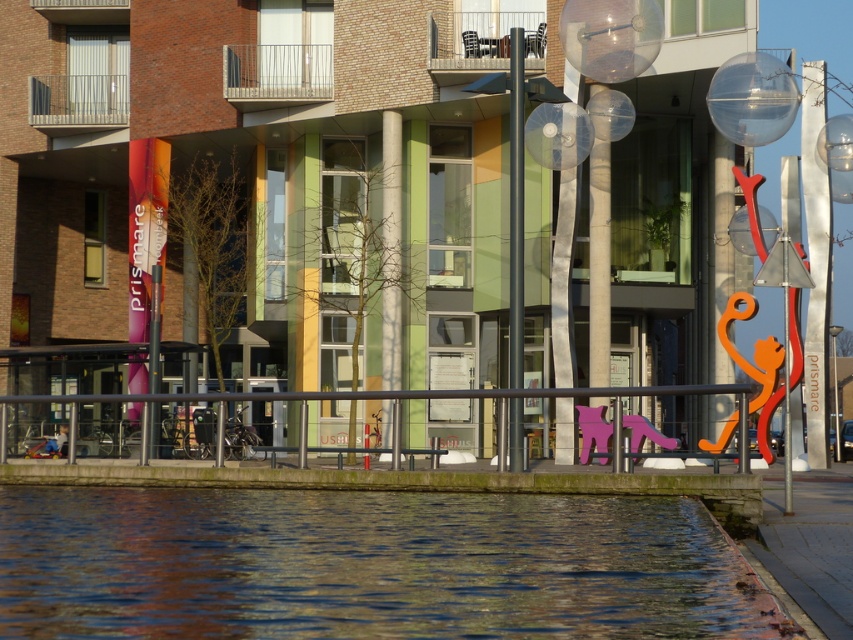
Which is behind, point (619, 602) or point (218, 456)?

The point (218, 456) is more distant.

Does point (361, 609) come closer to viewer compared to point (53, 403)?

Yes, it is in front of point (53, 403).

Is point (218, 586) less distant than point (79, 396)?

Yes, point (218, 586) is closer to viewer.

I want to click on clear water at lower left, so click(369, 564).

Find the location of a particular element. The width and height of the screenshot is (853, 640). clear water at lower left is located at coordinates (369, 564).

Which is above, clear water at lower left or polished metal pole at center?

polished metal pole at center is above.

Which is behind, point (593, 556) or point (511, 109)?

The point (511, 109) is behind.

This screenshot has height=640, width=853. What are the coordinates of `clear water at lower left` in the screenshot? It's located at (369, 564).

Can you confirm if black metal rail at lower center is shorter than polished metal pole at center?

Correct, black metal rail at lower center is not as tall as polished metal pole at center.

Which is more to the left, black metal rail at lower center or polished metal pole at center?

black metal rail at lower center is more to the left.

In order to click on black metal rail at lower center in this screenshot , I will do `click(352, 397)`.